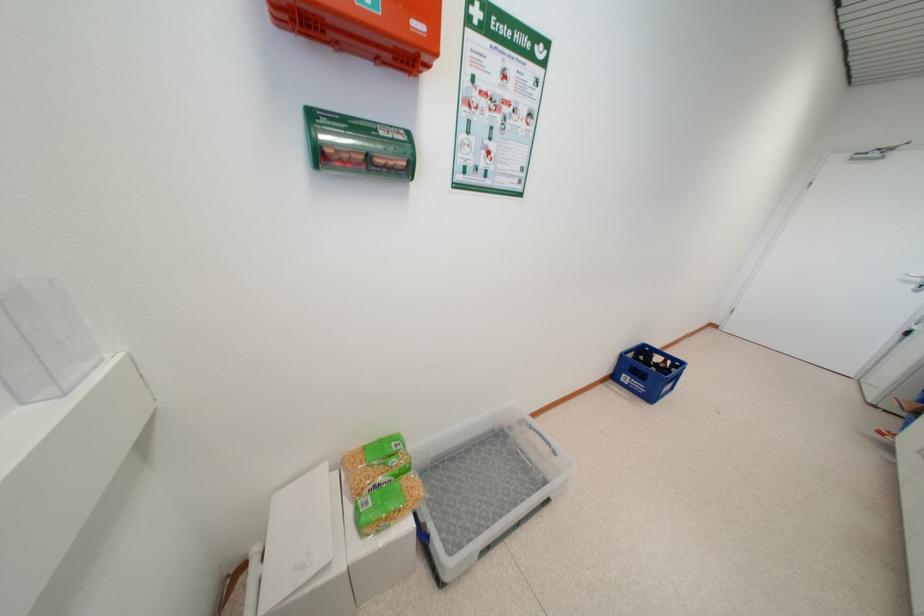
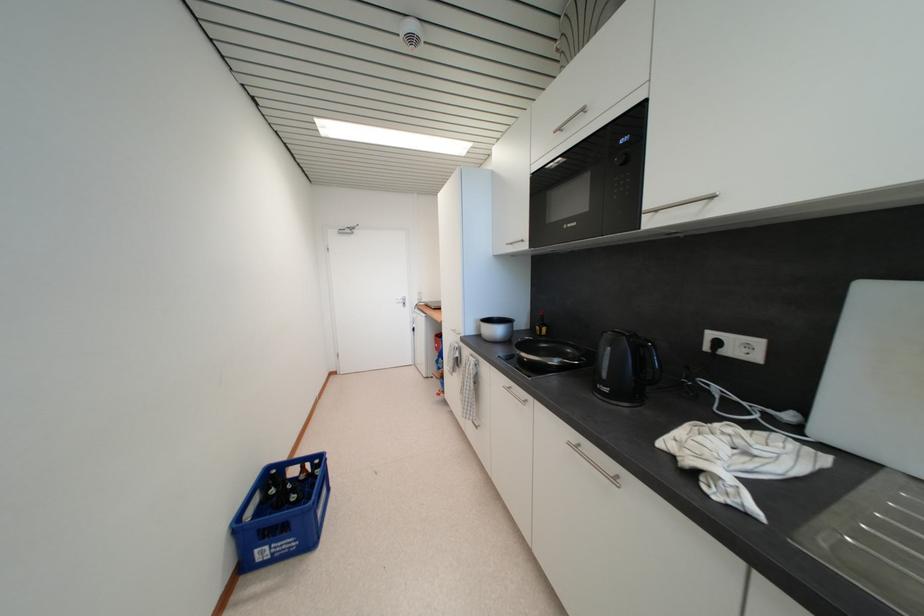
Question: The images are taken continuously from a first-person perspective. In which direction is your viewpoint rotating?

Choices:
 (A) Left
 (B) Right
 (C) Up
 (D) Down

Answer: (B)